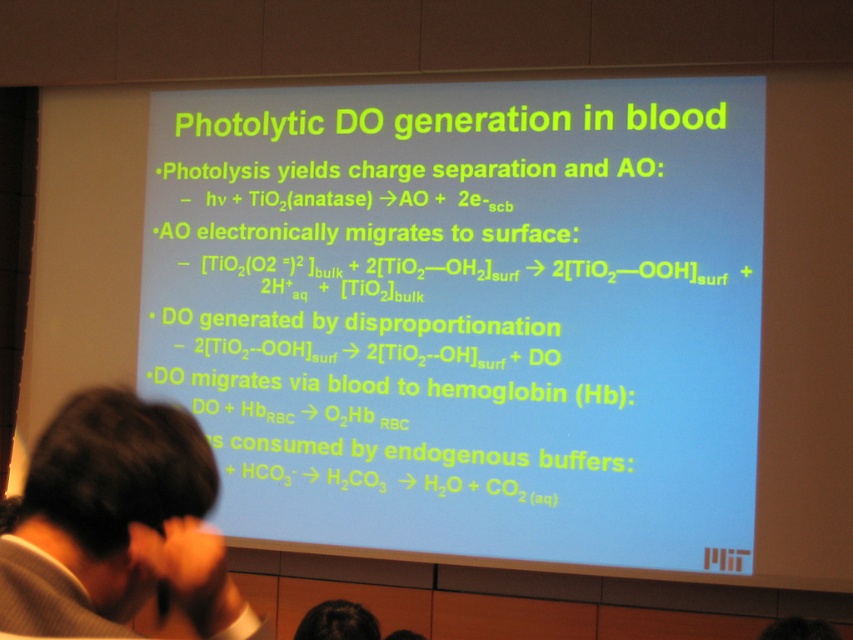
Is white text on blue background at center bigger than dark hair at lower left?

Indeed, white text on blue background at center has a larger size compared to dark hair at lower left.

Consider the image. Who is shorter, white text on blue background at center or dark hair at lower left?

With less height is dark hair at lower left.

Is point (628, 314) positioned behind point (105, 611)?

Yes, it is behind point (105, 611).

Image resolution: width=853 pixels, height=640 pixels. I want to click on white text on blue background at center, so click(467, 312).